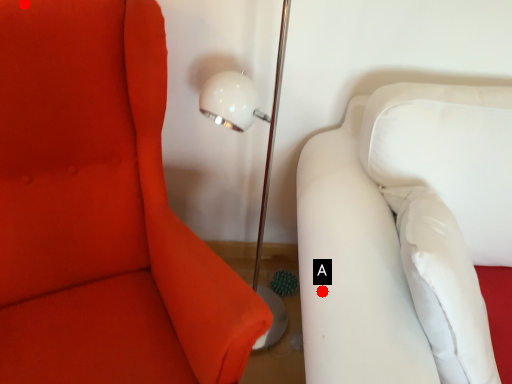
Question: Two points are circled on the image, labeled by A and B beside each circle. Which point is closer to the camera?

Choices:
 (A) A is closer
 (B) B is closer

Answer: (A)